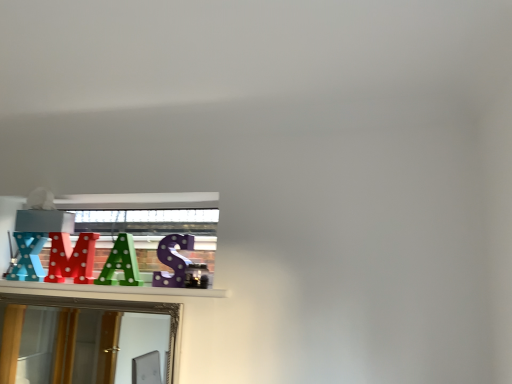
Question: From a real-world perspective, is gold-framed mirror at lower left located beneath green polka dot letter at center?

Choices:
 (A) yes
 (B) no

Answer: (A)

Question: From a real-world perspective, does gold-framed mirror at lower left stand above green polka dot letter at center?

Choices:
 (A) yes
 (B) no

Answer: (B)

Question: Is gold-framed mirror at lower left at the right side of green polka dot letter at center?

Choices:
 (A) yes
 (B) no

Answer: (B)

Question: Does gold-framed mirror at lower left have a smaller size compared to green polka dot letter at center?

Choices:
 (A) no
 (B) yes

Answer: (A)

Question: Is gold-framed mirror at lower left wider than green polka dot letter at center?

Choices:
 (A) no
 (B) yes

Answer: (B)

Question: Can you confirm if gold-framed mirror at lower left is thinner than green polka dot letter at center?

Choices:
 (A) no
 (B) yes

Answer: (A)

Question: From a real-world perspective, is green polka dot letter at center positioned over gold-framed mirror at lower left based on gravity?

Choices:
 (A) yes
 (B) no

Answer: (A)

Question: Is the position of green polka dot letter at center more distant than that of gold-framed mirror at lower left?

Choices:
 (A) yes
 (B) no

Answer: (A)

Question: Is gold-framed mirror at lower left inside green polka dot letter at center?

Choices:
 (A) no
 (B) yes

Answer: (A)

Question: Is green polka dot letter at center shorter than gold-framed mirror at lower left?

Choices:
 (A) yes
 (B) no

Answer: (A)

Question: Is green polka dot letter at center aimed at gold-framed mirror at lower left?

Choices:
 (A) yes
 (B) no

Answer: (B)

Question: Is green polka dot letter at center far away from gold-framed mirror at lower left?

Choices:
 (A) no
 (B) yes

Answer: (B)

Question: From the image's perspective, is gold-framed mirror at lower left positioned above or below green polka dot letter at center?

Choices:
 (A) below
 (B) above

Answer: (A)